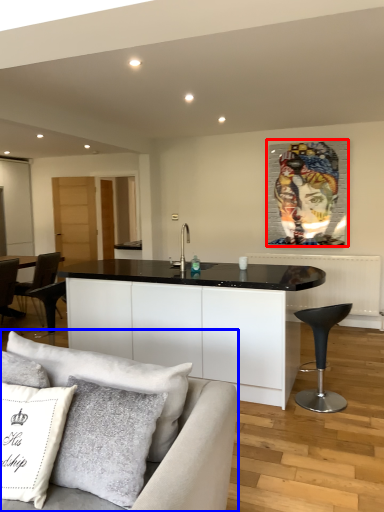
Question: Which object appears farthest to the camera in this image, picture frame (highlighted by a red box) or studio couch (highlighted by a blue box)?

Choices:
 (A) picture frame
 (B) studio couch

Answer: (A)